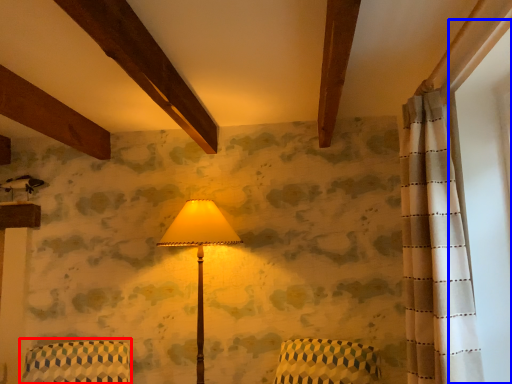
Question: Among these objects, which one is nearest to the camera, armchair (highlighted by a red box) or window screen (highlighted by a blue box)?

Choices:
 (A) armchair
 (B) window screen

Answer: (B)